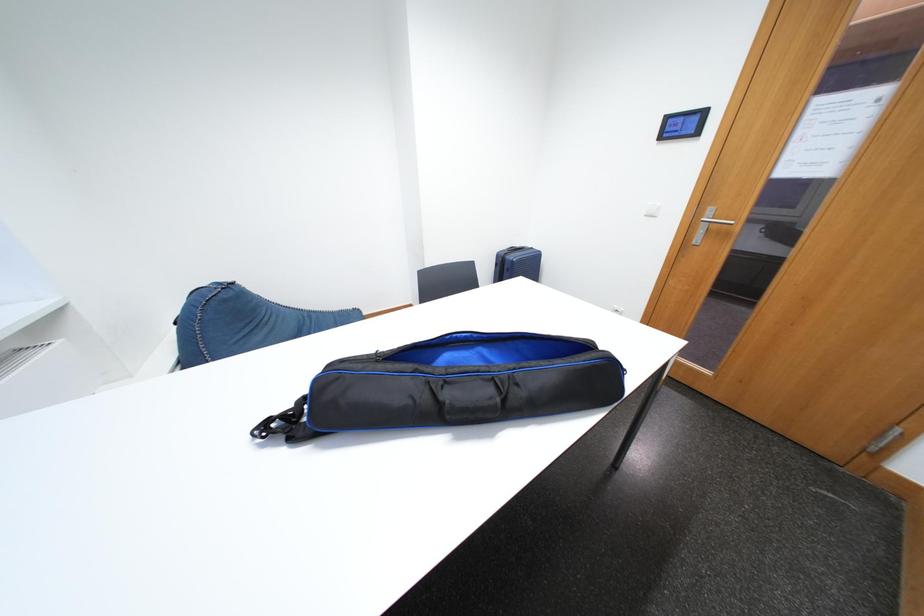
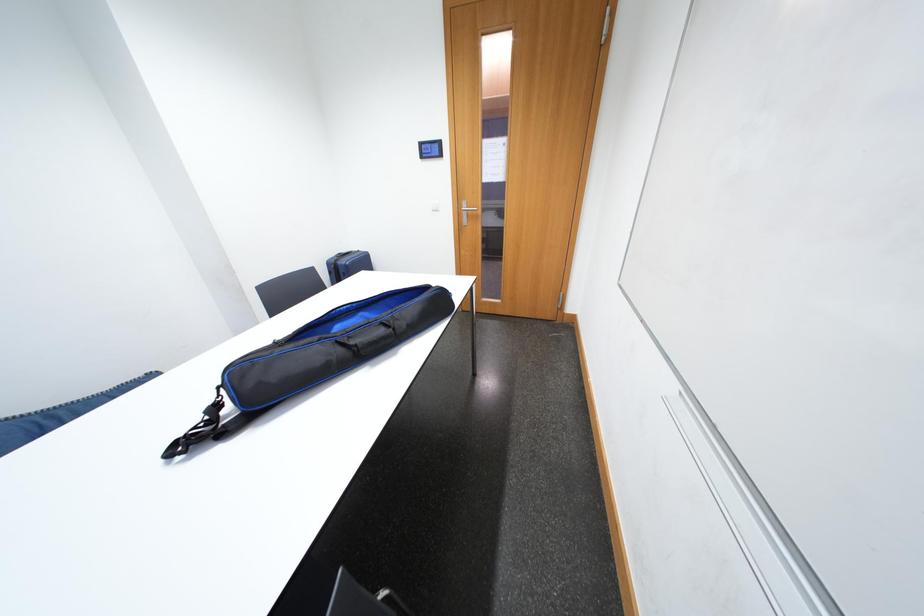
Question: The camera is either moving clockwise (left) or counter-clockwise (right) around the object. The first image is from the beginning of the video and the second image is from the end. Is the camera moving left or right when shooting the video?

Choices:
 (A) Left
 (B) Right

Answer: (A)